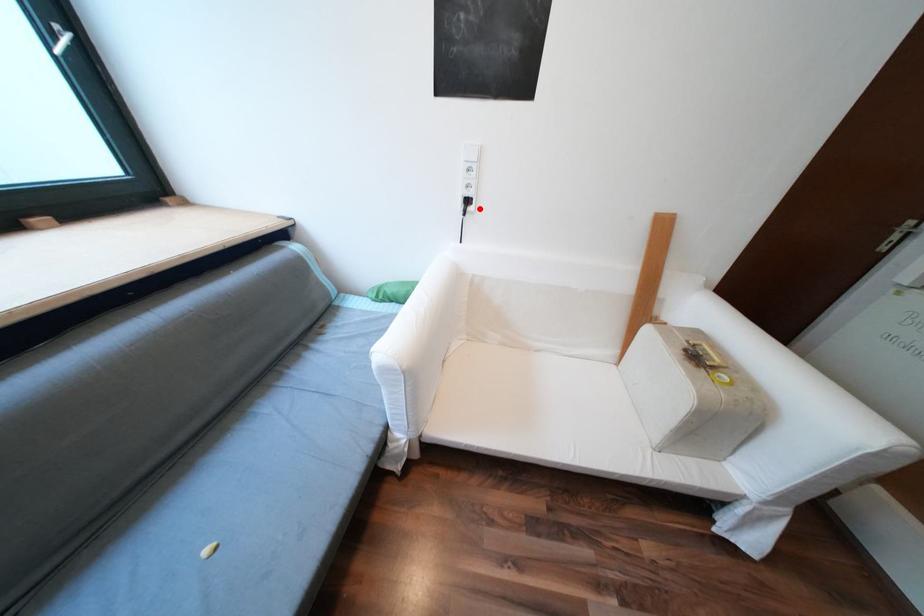
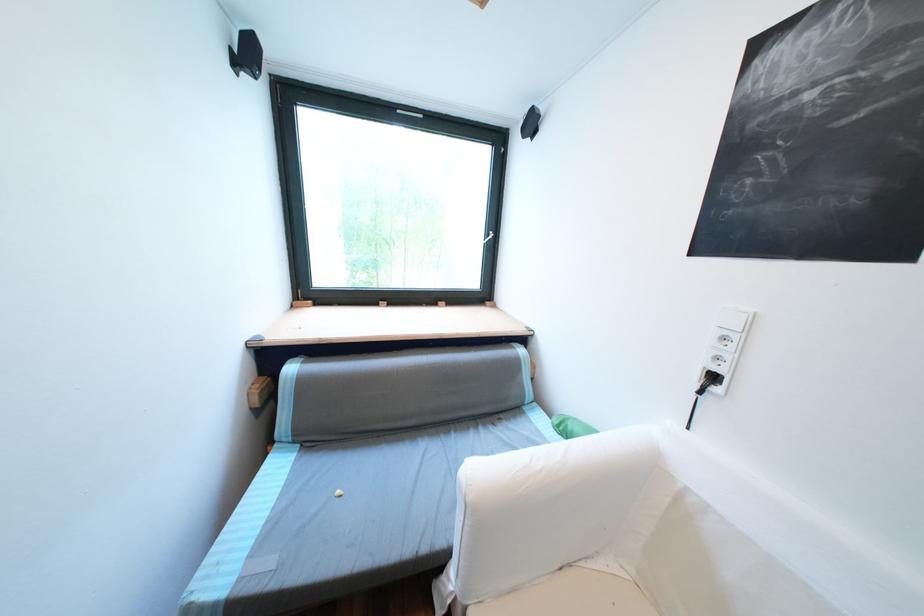
Question: I am providing you with two images of the same scene from different viewpoints. In image1, a red point is highlighted. Considering the same 3D point in image2, which of the following is correct?

Choices:
 (A) It is closer
 (B) It is farther

Answer: (B)